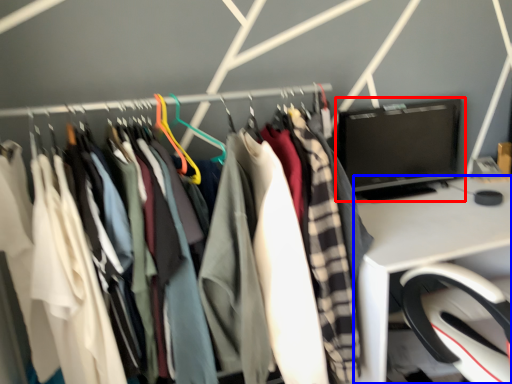
Question: Which point is closer to the camera, computer monitor (highlighted by a red box) or desk (highlighted by a blue box)?

Choices:
 (A) computer monitor
 (B) desk

Answer: (B)